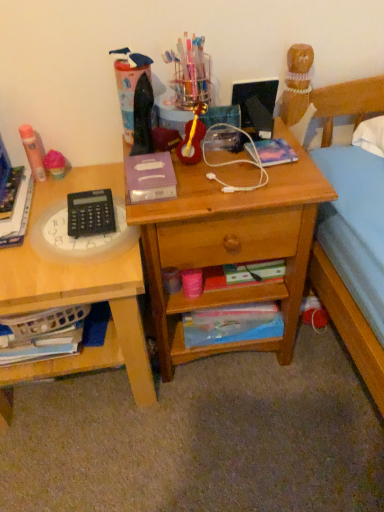
Question: Can you confirm if purple matte paperback book at center, the 3th paperback book when ordered from back to front, is thinner than matte orange glue stick at left, marked as the first stationery in a left-to-right arrangement?

Choices:
 (A) yes
 (B) no

Answer: (B)

Question: Can you confirm if purple matte paperback book at center, the 3th paperback book when ordered from back to front, is shorter than matte orange glue stick at left, which is the 3th stationery from right to left?

Choices:
 (A) no
 (B) yes

Answer: (B)

Question: Is purple matte paperback book at center, which appears as the 2th paperback book when viewed from the top, not within matte orange glue stick at left, which is the 3th stationery from right to left?

Choices:
 (A) yes
 (B) no

Answer: (A)

Question: From the image's perspective, is purple matte paperback book at center, arranged as the 2th paperback book when ordered from the bottom, located beneath matte orange glue stick at left, marked as the first stationery in a left-to-right arrangement?

Choices:
 (A) no
 (B) yes

Answer: (B)

Question: Is purple matte paperback book at center, arranged as the 2th paperback book when ordered from the bottom, closer to the viewer compared to matte orange glue stick at left, which is the 3th stationery from right to left?

Choices:
 (A) yes
 (B) no

Answer: (A)

Question: Choose the correct answer: Is black plastic calculator at left inside shiny black laptop at upper center or outside it?

Choices:
 (A) inside
 (B) outside

Answer: (B)

Question: Looking at the image, does black plastic calculator at left seem bigger or smaller compared to shiny black laptop at upper center?

Choices:
 (A) small
 (B) big

Answer: (A)

Question: Considering the positions of point (x=77, y=221) and point (x=261, y=129), is point (x=77, y=221) closer or farther from the camera than point (x=261, y=129)?

Choices:
 (A) farther
 (B) closer

Answer: (B)

Question: From a real-world perspective, is black plastic calculator at left physically located above or below shiny black laptop at upper center?

Choices:
 (A) below
 (B) above

Answer: (A)

Question: From their relative heights in the image, would you say hardcover book at left is taller or shorter than shiny black laptop at upper center?

Choices:
 (A) tall
 (B) short

Answer: (B)

Question: Is hardcover book at left in front of or behind shiny black laptop at upper center in the image?

Choices:
 (A) behind
 (B) front

Answer: (B)

Question: Looking at their shapes, would you say hardcover book at left is wider or thinner than shiny black laptop at upper center?

Choices:
 (A) thin
 (B) wide

Answer: (B)

Question: Looking at the image, does hardcover book at left seem bigger or smaller compared to shiny black laptop at upper center?

Choices:
 (A) small
 (B) big

Answer: (B)

Question: Is wooden desk at center taller or shorter than white matte earphones at center?

Choices:
 (A) tall
 (B) short

Answer: (A)

Question: In the image, is wooden desk at center positioned in front of or behind white matte earphones at center?

Choices:
 (A) behind
 (B) front

Answer: (B)